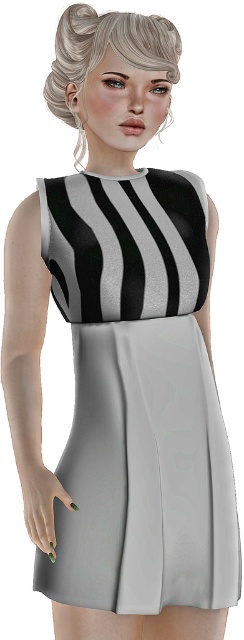
You are a fashion designer preparing for a photoshoot. You need to decide whether to place a decorative accessory between the blonde hair at upper center and the green matte nails at lower left. Given their sizes, which object should the accessory be placed closer to to ensure it doesn

The accessory should be placed closer to the green matte nails at lower left because the blonde hair at upper center is wider than the green matte nails at lower left, so the accessory needs to be positioned near the narrower object to maintain balance.

You are a fashion designer observing the digital rendering. You need to adjust the placement of the blonde hair at upper center and the green matte nails at lower left so that they are aligned vertically. Which object should you move and in which direction?

The blonde hair at upper center is to the right of green matte nails at lower left. To align them vertically, you should move the blonde hair at upper center to the left until it is directly above the green matte nails at lower left.

You are a photographer setting up for a photoshoot and need to ensure that the blonde hair at upper center and the green matte nails at lower left are within a 24 inch frame. Can you fit both elements into the frame without moving the camera?

The distance between the blonde hair at upper center and the green matte nails at lower left is 26.19 inches, which exceeds the 24 inch frame. Therefore, both elements cannot fit within the frame without adjusting the camera position.